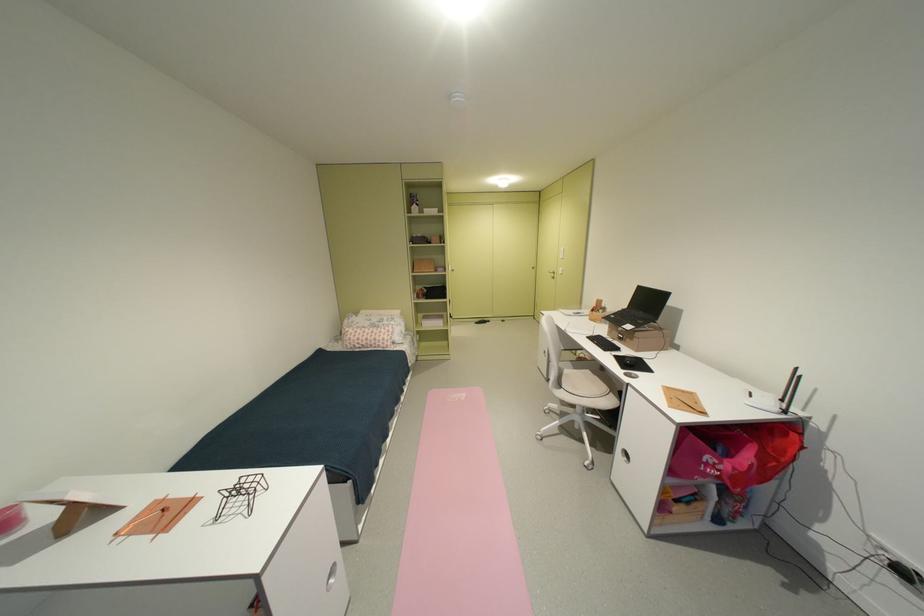
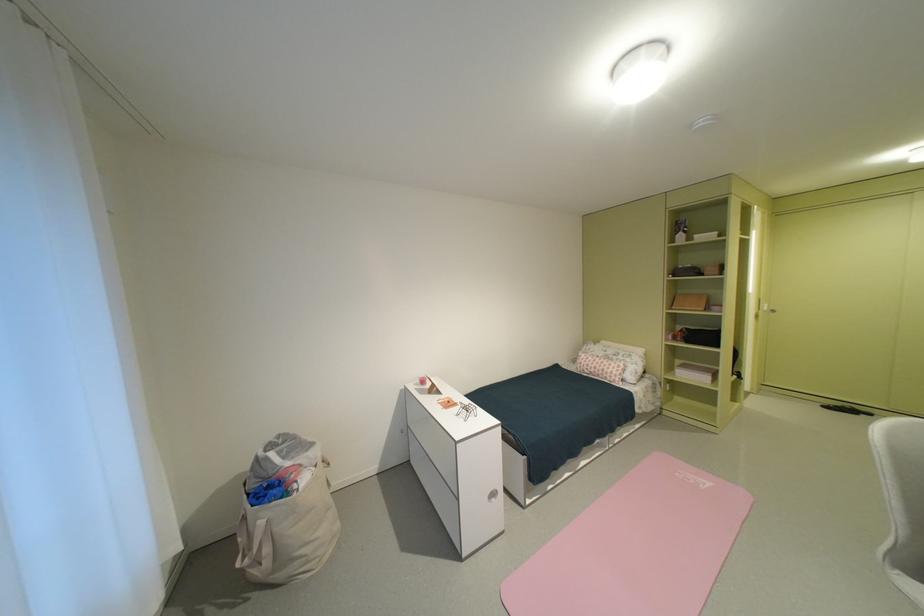
Question: The camera is either moving clockwise (left) or counter-clockwise (right) around the object. The first image is from the beginning of the video and the second image is from the end. Is the camera moving left or right when shooting the video?

Choices:
 (A) Left
 (B) Right

Answer: (B)